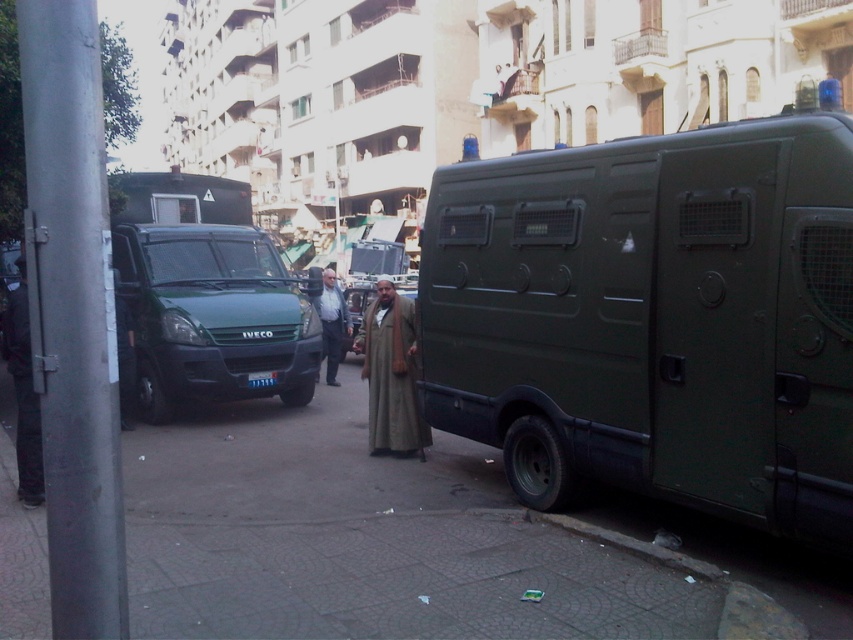
Based on the photo, which is more to the left, black leather pants at left or dark brown leather jacket at center?

From the viewer's perspective, black leather pants at left appears more on the left side.

Does point (30, 448) come closer to viewer compared to point (332, 348)?

Yes, point (30, 448) is closer to viewer.

Between point (33, 464) and point (331, 364), which one is positioned behind?

Point (331, 364)

Find the location of a particular element. This screenshot has width=853, height=640. black leather pants at left is located at coordinates (22, 392).

Looking at this image, can you confirm if matte green van at right is smaller than black leather pants at left?

No.

Does matte green van at right appear over black leather pants at left?

Yes.

What are the coordinates of `matte green van at right` in the screenshot? It's located at (654, 317).

I want to click on matte green van at right, so click(654, 317).

Which is behind, point (364, 372) or point (321, 330)?

The point (321, 330) is behind.

This screenshot has width=853, height=640. Describe the element at coordinates (392, 374) in the screenshot. I see `beige woolen robe at center` at that location.

Locate an element on the screen. Image resolution: width=853 pixels, height=640 pixels. beige woolen robe at center is located at coordinates (392, 374).